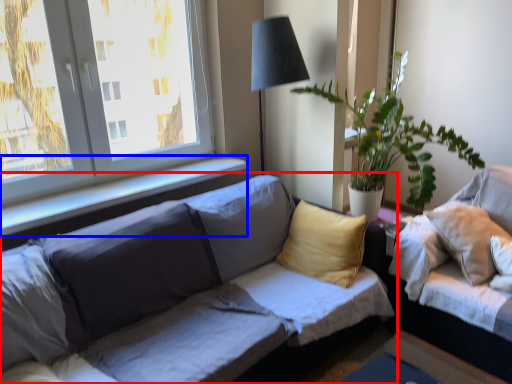
Question: Which of the following is the closest to the observer, studio couch (highlighted by a red box) or window sill (highlighted by a blue box)?

Choices:
 (A) studio couch
 (B) window sill

Answer: (A)